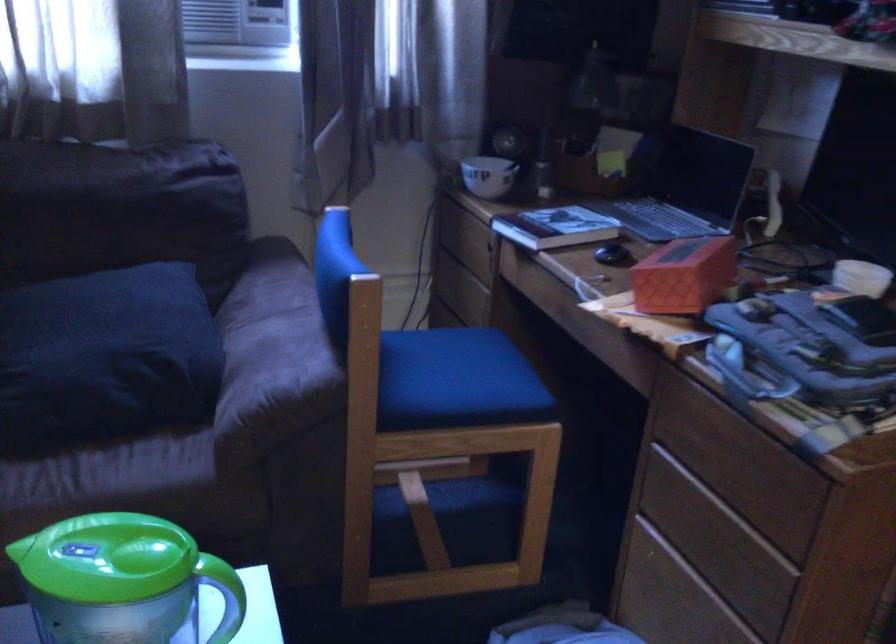
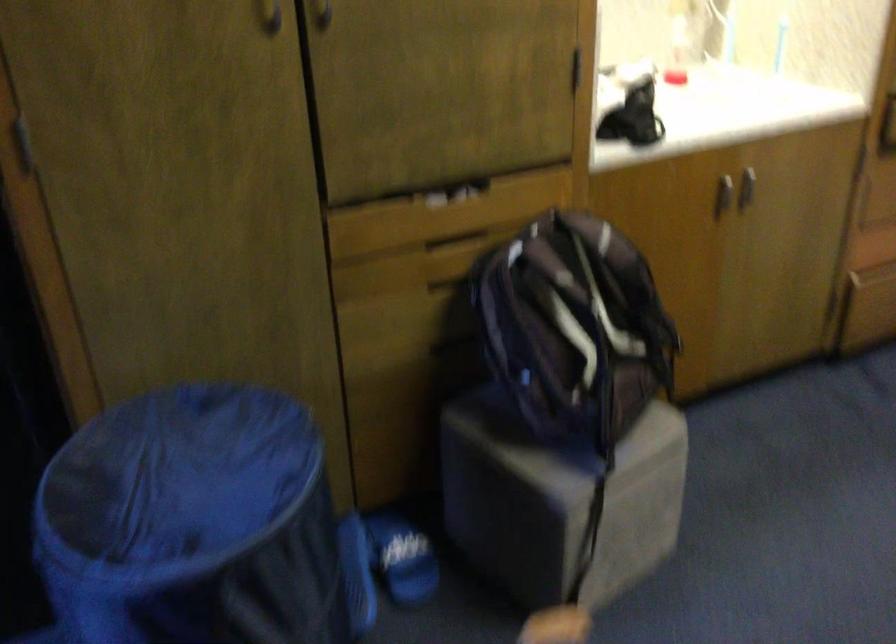
The images are taken continuously from a first-person perspective. In which direction is your viewpoint rotating?

The rotation direction of the camera is right-down.